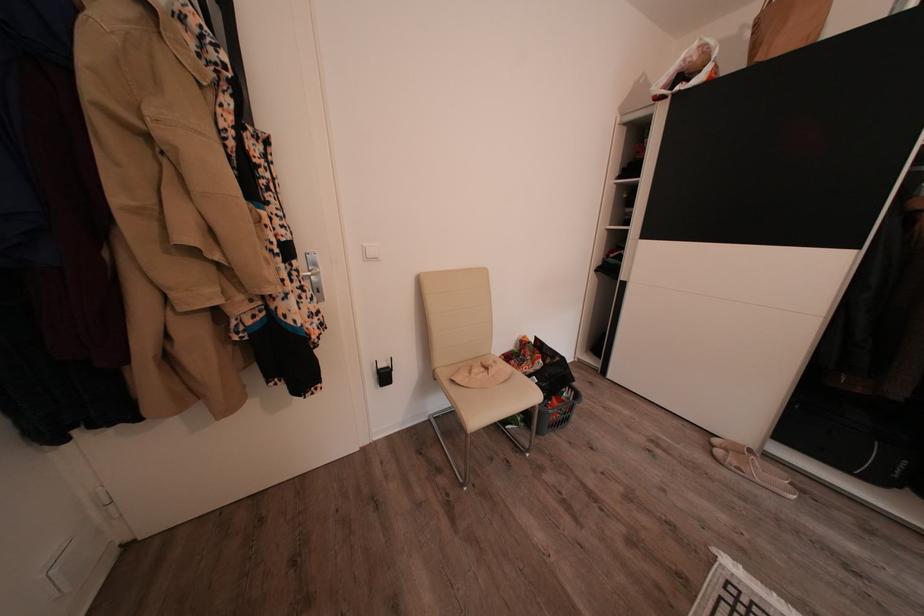
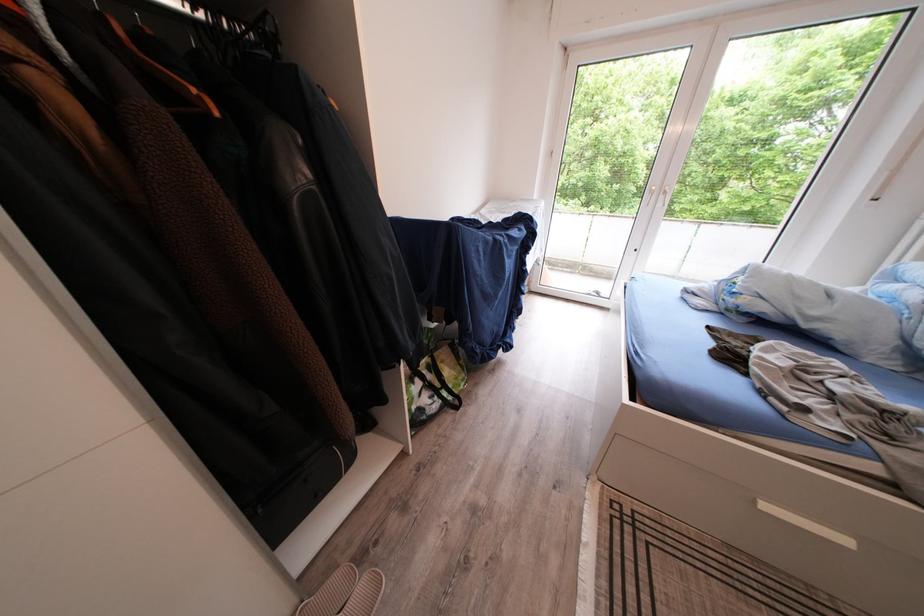
In the second image, find the point that corresponds to the point at 786,476 in the first image.

(347, 583)